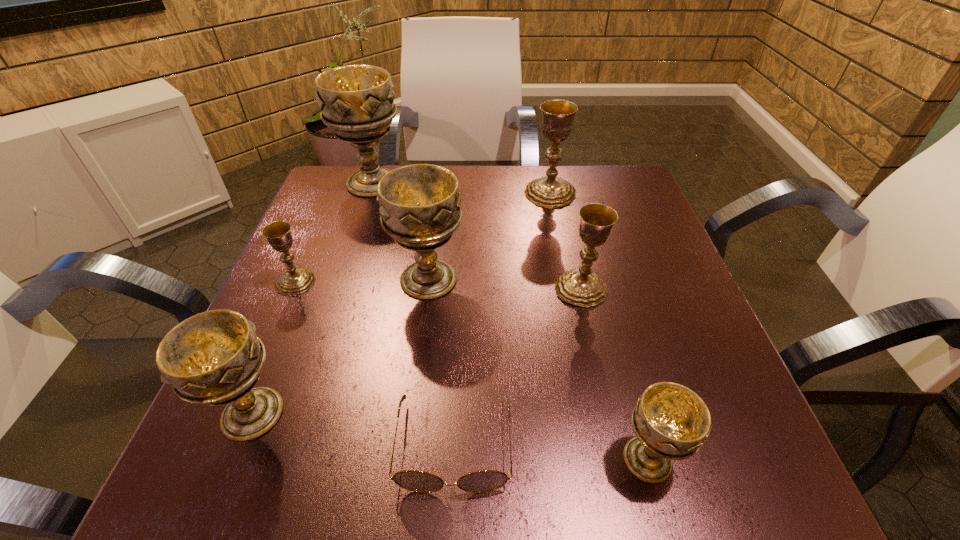
Identify the location of free space between the farthest gold chalice and the shortest object. The width and height of the screenshot is (960, 540). (502, 319).

I want to click on vacant space in between the rightmost white chalice and the fourth chalice from right to left, so click(538, 369).

At what (x,y) coordinates should I click in order to perform the action: click on vacant space that is in between the smallest white chalice and the shortest object. Please return your answer as a coordinate pair (x, y). The image size is (960, 540). Looking at the image, I should click on (551, 452).

Identify the location of vacant space that's between the third white chalice from left to right and the smallest gold chalice. Image resolution: width=960 pixels, height=540 pixels. (362, 281).

Find the location of `unoccupied area between the shortest object and the leftmost gold chalice`. unoccupied area between the shortest object and the leftmost gold chalice is located at coordinates (374, 363).

I want to click on object that is the second closest one to the shortest object, so click(214, 358).

Locate an element on the screen. The height and width of the screenshot is (540, 960). object that is the fifth nearest to the sunglasses is located at coordinates (295, 281).

The height and width of the screenshot is (540, 960). What are the coordinates of `chalice that is the third closest to the rightmost white chalice` in the screenshot? It's located at (214, 358).

Find the location of a particular element. chalice that is the fifth closest to the third white chalice from left to right is located at coordinates (550, 191).

At what (x,y) coordinates should I click in order to perform the action: click on the fourth closest white chalice relative to the biggest gold chalice. Please return your answer as a coordinate pair (x, y). The width and height of the screenshot is (960, 540). Looking at the image, I should click on (214, 358).